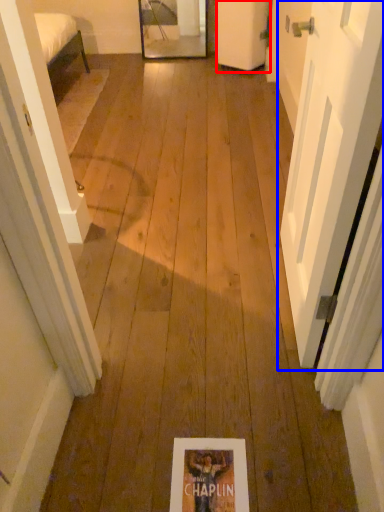
Question: Which object is further to the camera taking this photo, door (highlighted by a red box) or door (highlighted by a blue box)?

Choices:
 (A) door
 (B) door

Answer: (A)